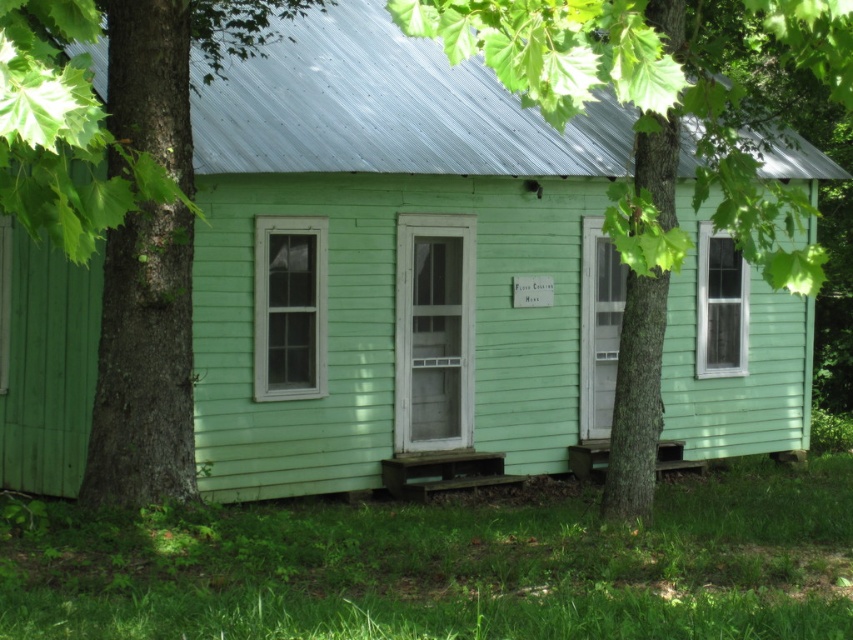
Who is taller, green rough bark tree at left or green wood tree at center?

Standing taller between the two is green wood tree at center.

Which is in front, point (125, 413) or point (405, 10)?

Positioned in front is point (405, 10).

Identify the location of green rough bark tree at left. This screenshot has height=640, width=853. (122, 204).